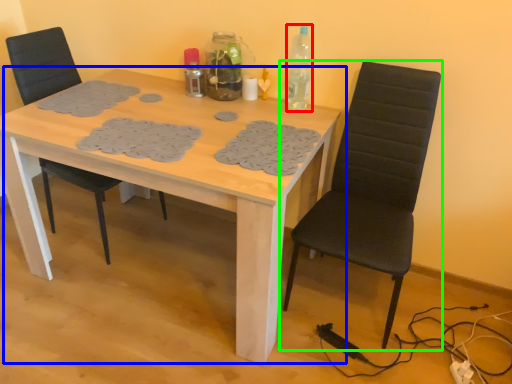
Question: Estimate the real-world distances between objects in this image. Which object is farther from bottle (highlighted by a red box), table (highlighted by a blue box) or chair (highlighted by a green box)?

Choices:
 (A) table
 (B) chair

Answer: (A)